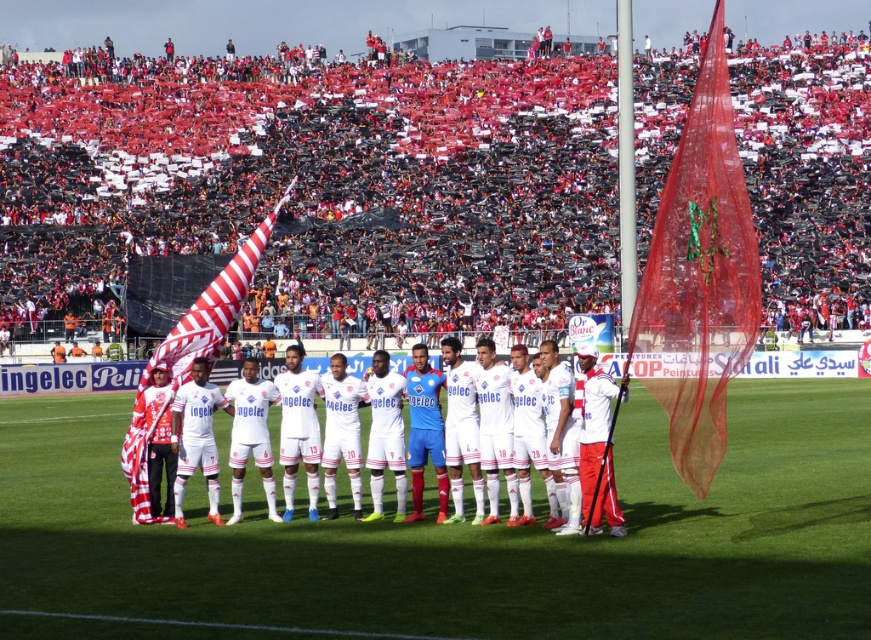
Question: Is translucent red flag at right bigger than striped fabric flag at center?

Choices:
 (A) yes
 (B) no

Answer: (B)

Question: From the image, what is the correct spatial relationship of translucent red flag at right in relation to white matte soccer team at center?

Choices:
 (A) left
 (B) right

Answer: (B)

Question: Which point appears farthest from the camera in this image?

Choices:
 (A) (716, 19)
 (B) (397, 410)

Answer: (B)

Question: Which of the following is the farthest from the observer?

Choices:
 (A) (167, 548)
 (B) (149, 497)
 (C) (287, 200)

Answer: (C)

Question: Which object appears closest to the camera in this image?

Choices:
 (A) translucent red flag at right
 (B) striped fabric flag at center
 (C) white matte soccer team at center
 (D) green grass football field at center

Answer: (D)

Question: Does green grass football field at center have a larger size compared to striped fabric flag at center?

Choices:
 (A) yes
 (B) no

Answer: (B)